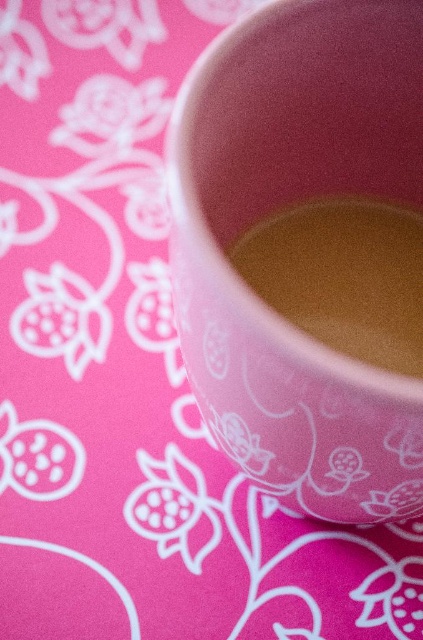
You are observing the pink ceramic bowl and the surface beneath it. Which of the two points, point (379,193) or point (288,209), is closer to your eyes?

Point (379,193) is closer to your eyes because it is further to the viewer than point (288,209).

You are holding a smartphone with a camera that has a minimum focus distance of 12 inches. If you want to take a closeup photo of the matte pink cup at center, will you be able to focus on it without moving closer than 12 inches?

The matte pink cup at center is 22.17 inches away from the viewer, which is beyond the smartphone camera minimum focus distance of 12 inches. Therefore, you can focus on the matte pink cup at center without needing to move closer than 12 inches.